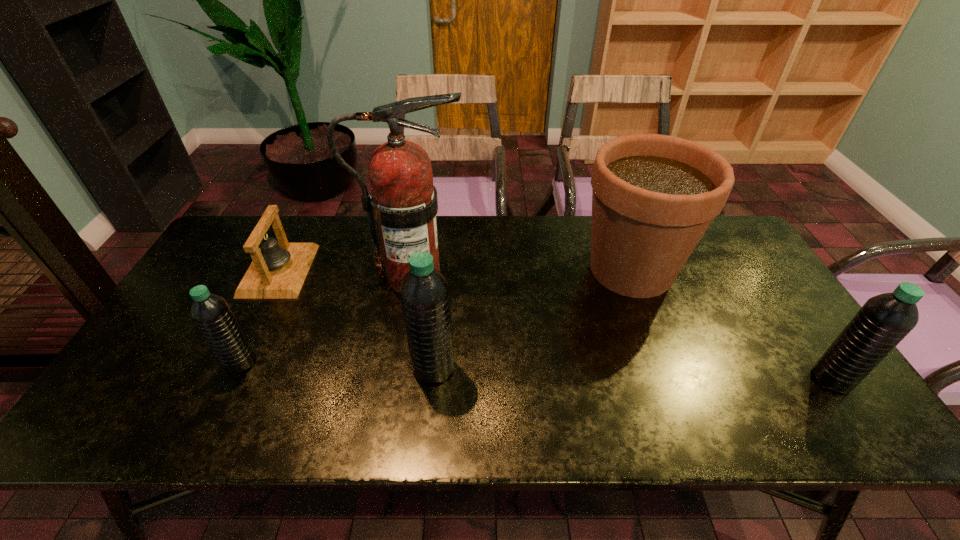
Please point a space for a new water_bottle to maintain equal intervals. Please provide its 2D coordinates. Your answer should be formatted as a tuple, i.e. [(x, y)], where the tuple contains the x and y coordinates of a point satisfying the conditions above.

[(631, 373)]